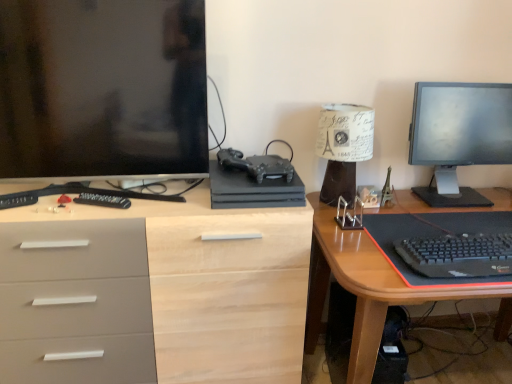
I want to click on vacant space to the right of white paper lampshade at upper right, so click(x=381, y=197).